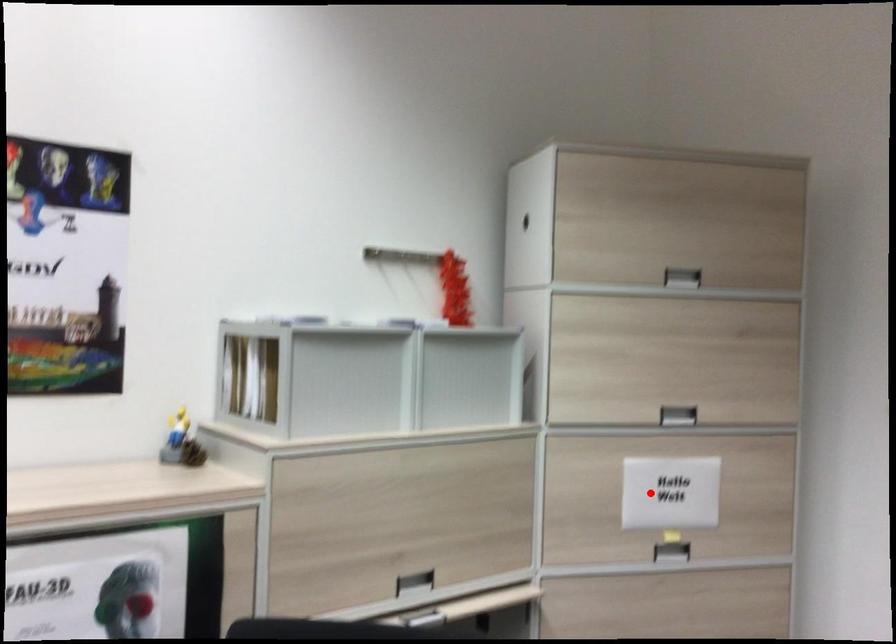
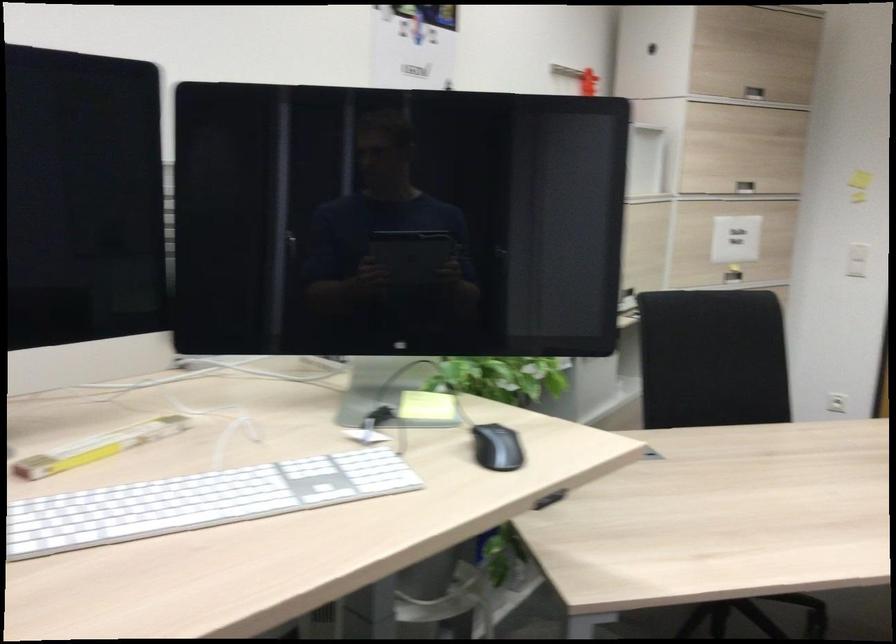
Question: I am providing you with two images of the same scene from different viewpoints. A red point is shown in image1. For the corresponding object point in image2, is it positioned nearer or farther from the camera?

Choices:
 (A) Nearer
 (B) Farther

Answer: (B)